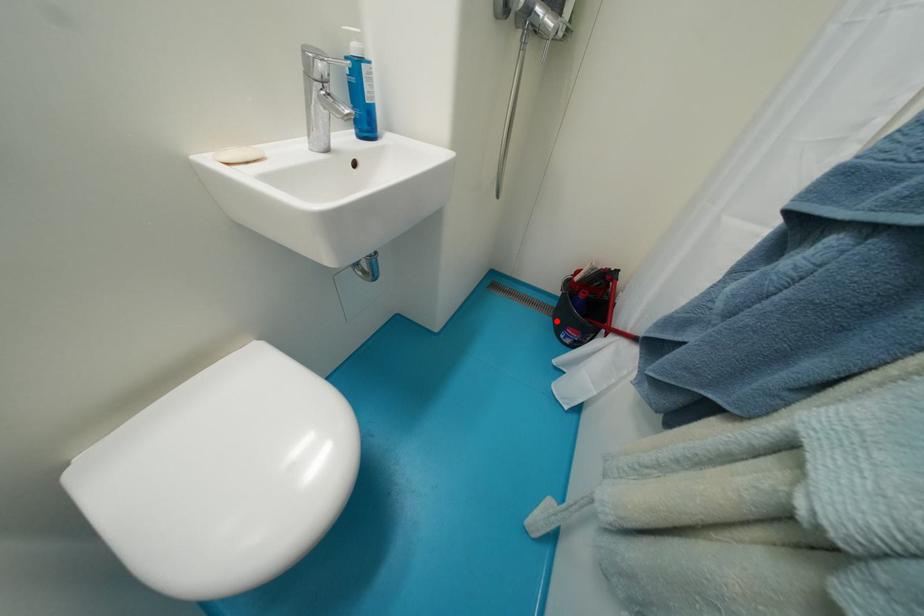
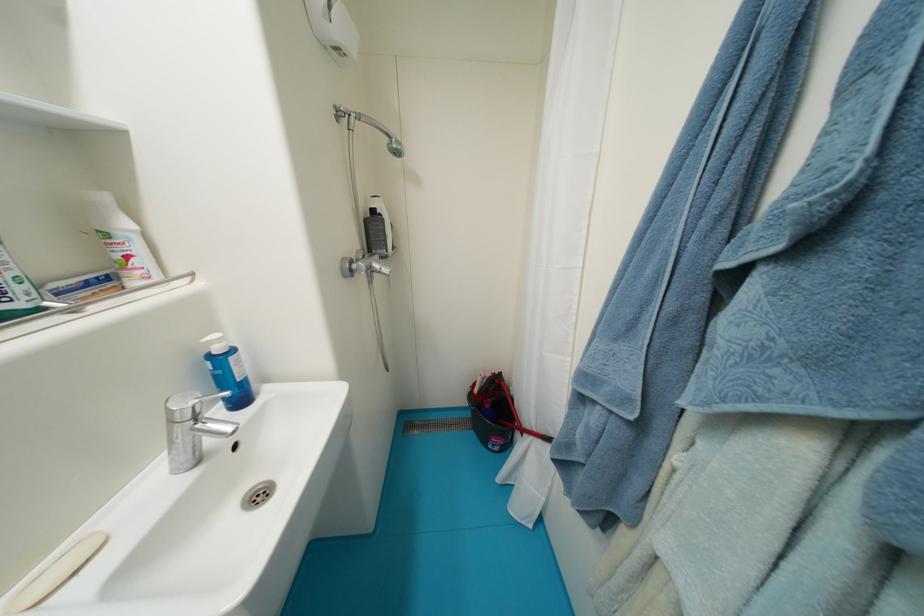
In the second image, find the point that corresponds to the highlighted location in the first image.

(479, 435)